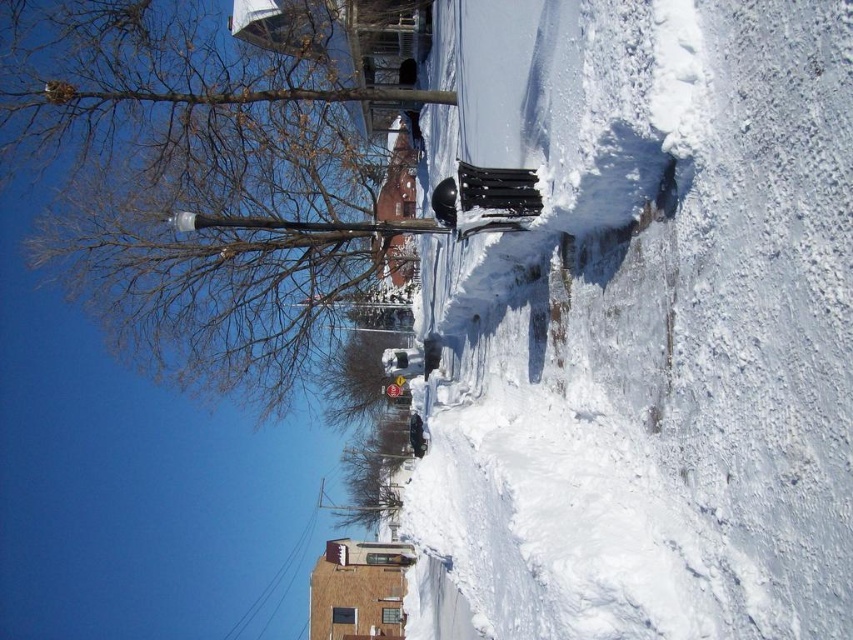
Measure the distance between black plastic trash can at center and camera.

13.60 feet

Which is behind, point (770, 492) or point (56, 122)?

The point (56, 122) is behind.

This screenshot has height=640, width=853. What do you see at coordinates (646, 321) in the screenshot? I see `black plastic trash can at center` at bounding box center [646, 321].

Identify the location of black plastic trash can at center. (646, 321).